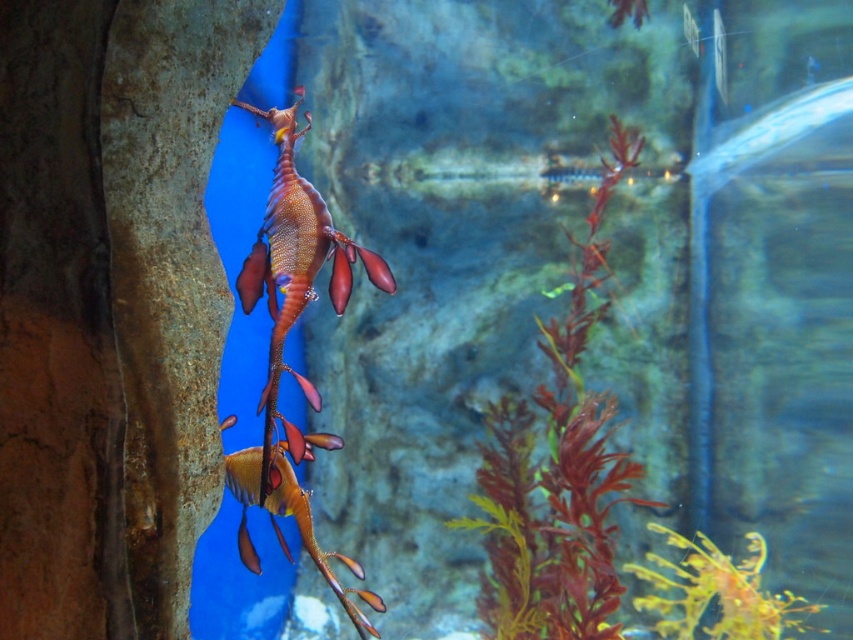
You are a marine biologist observing an underwater scene in an aquarium. You notice a point at coordinates (572, 266). Based on the scene description, what is located at that point?

The point at coordinates (572, 266) corresponds to translucent glass water at center.